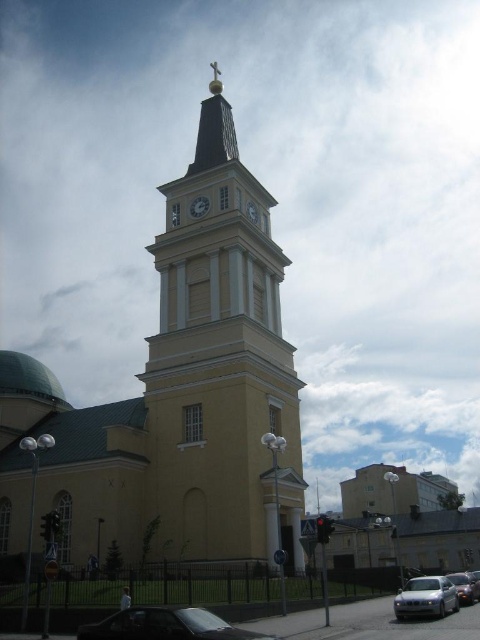
From the picture: Does metallic silver car at lower right appear under white glossy clock at upper center?

Yes.

Is metallic silver car at lower right above white glossy clock at upper center?

Actually, metallic silver car at lower right is below white glossy clock at upper center.

Between point (454, 577) and point (250, 208), which one is positioned in front?

Point (454, 577) is more forward.

Locate an element on the screen. Image resolution: width=480 pixels, height=640 pixels. metallic silver car at lower right is located at coordinates (466, 586).

Can you confirm if yellow matte tower at center is positioned to the left of white glossy clock at center?

No, yellow matte tower at center is not to the left of white glossy clock at center.

Who is positioned more to the right, yellow matte tower at center or white glossy clock at center?

yellow matte tower at center

Locate an element on the screen. The image size is (480, 640). yellow matte tower at center is located at coordinates (220, 364).

Does shiny black car at lower left come in front of metallic silver car at lower right?

Yes, shiny black car at lower left is in front of metallic silver car at lower right.

Who is more distant from viewer, (169, 632) or (463, 582)?

The point (463, 582) is more distant.

This screenshot has height=640, width=480. What are the coordinates of `shiny black car at lower left` in the screenshot? It's located at (166, 625).